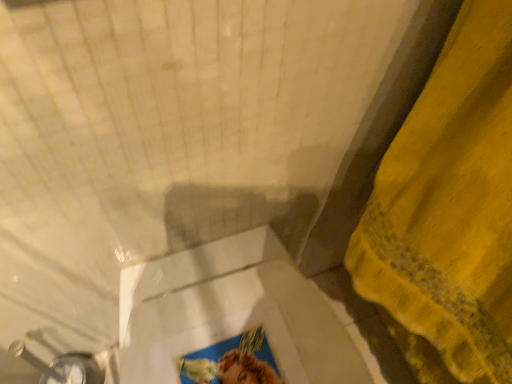
What do you see at coordinates (449, 211) in the screenshot? Image resolution: width=512 pixels, height=384 pixels. I see `yellow fabric at right` at bounding box center [449, 211].

At what (x,y) coordinates should I click in order to perform the action: click on yellow fabric at right. Please return your answer as a coordinate pair (x, y). Image resolution: width=512 pixels, height=384 pixels. Looking at the image, I should click on (449, 211).

Image resolution: width=512 pixels, height=384 pixels. Identify the location of yellow fabric at right. (449, 211).